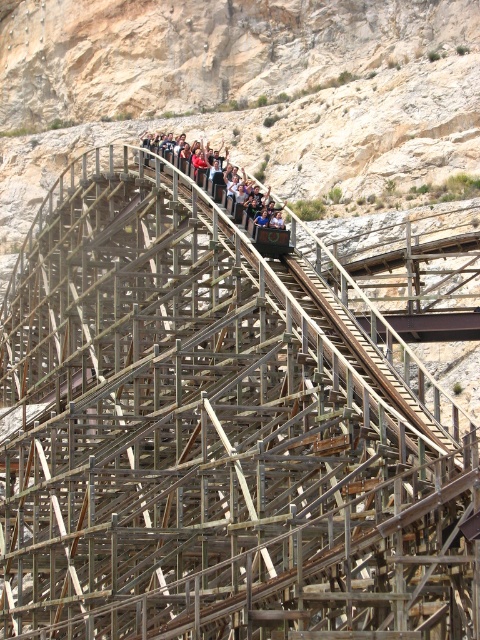
You are a safety inspector checking the wooden roller coaster at upper center. The safety regulations state that the distance between the coaster structure and the matte wooden roller coaster car at center must be less than 25 meters for proper alignment. Is the current distance within the required limit?

The distance between the wooden roller coaster at upper center and the matte wooden roller coaster car at center is 24.48 meters, which is less than the 25 meters requirement. Therefore, the current distance is within the required limit.

You are a safety inspector checking the wooden roller coaster at upper center and the matte wooden roller coaster car at center. Which of these two objects is positioned to the left from your viewpoint?

The wooden roller coaster at upper center is positioned to the left of the matte wooden roller coaster car at center.